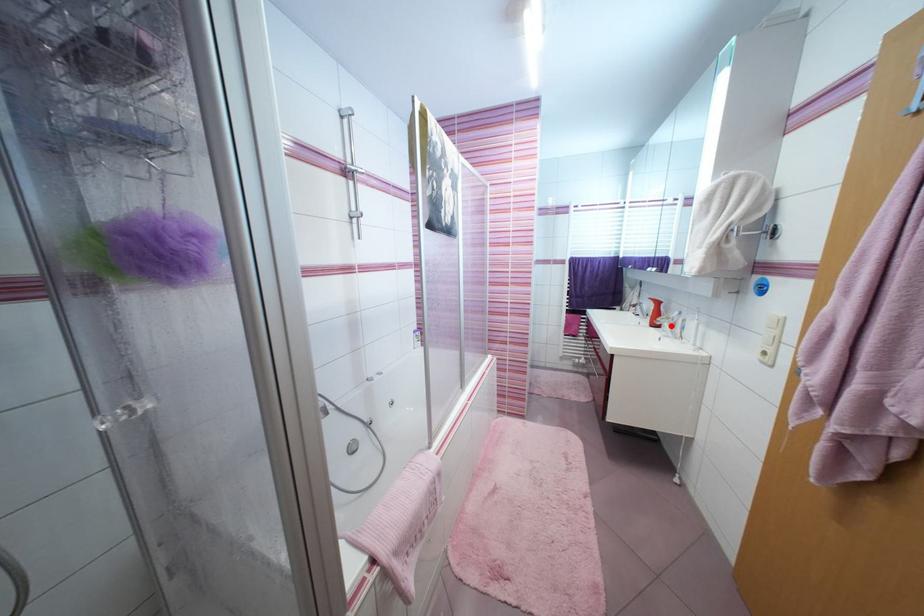
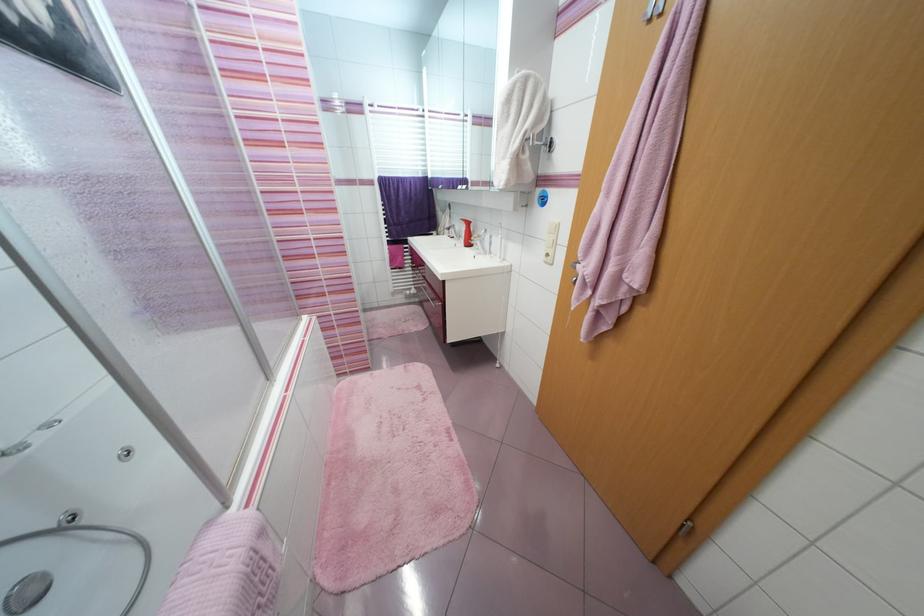
Find the pixel in the second image that matches the highlighted location in the first image.

(483, 244)